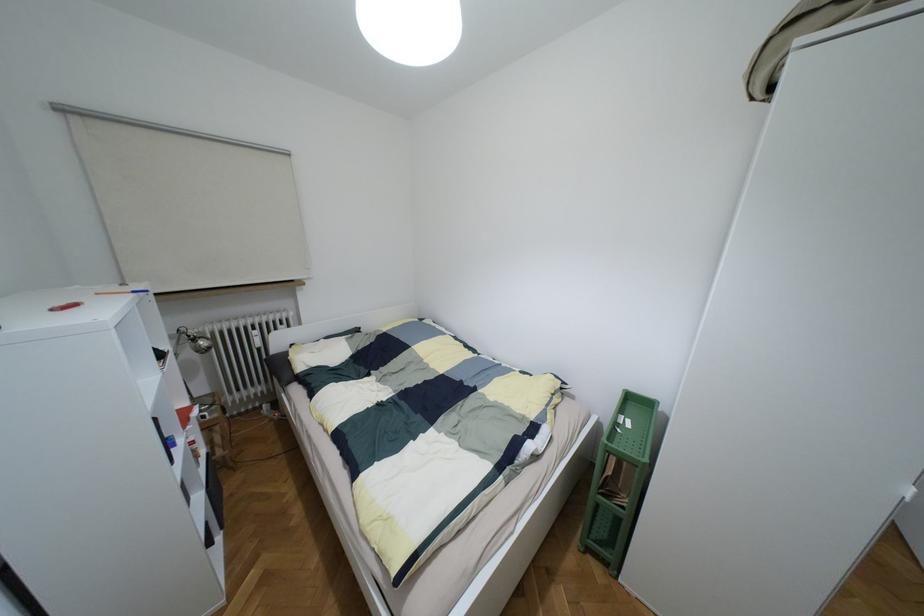
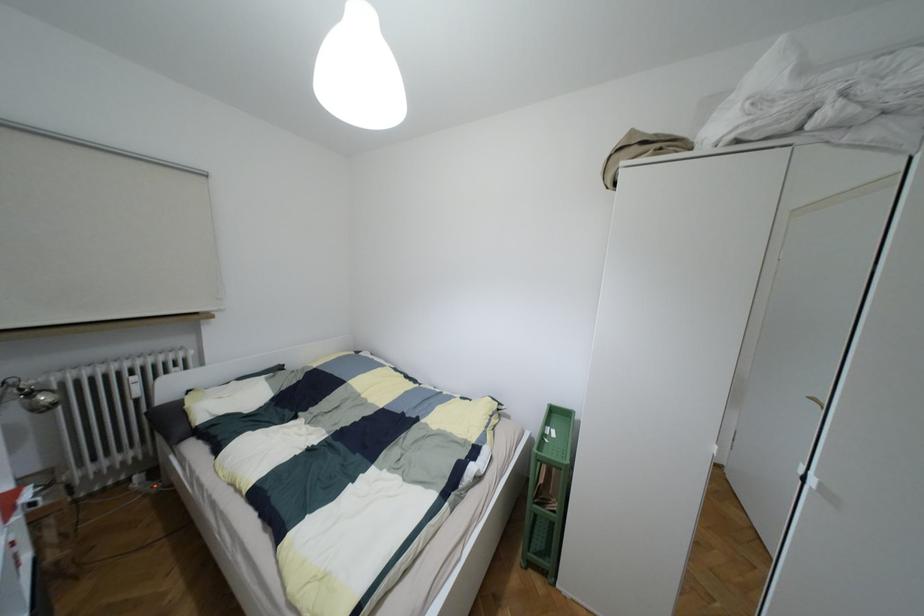
Question: What movement of the cameraman would produce the second image?

Choices:
 (A) Left
 (B) Right
 (C) Forward
 (D) Backward

Answer: (D)